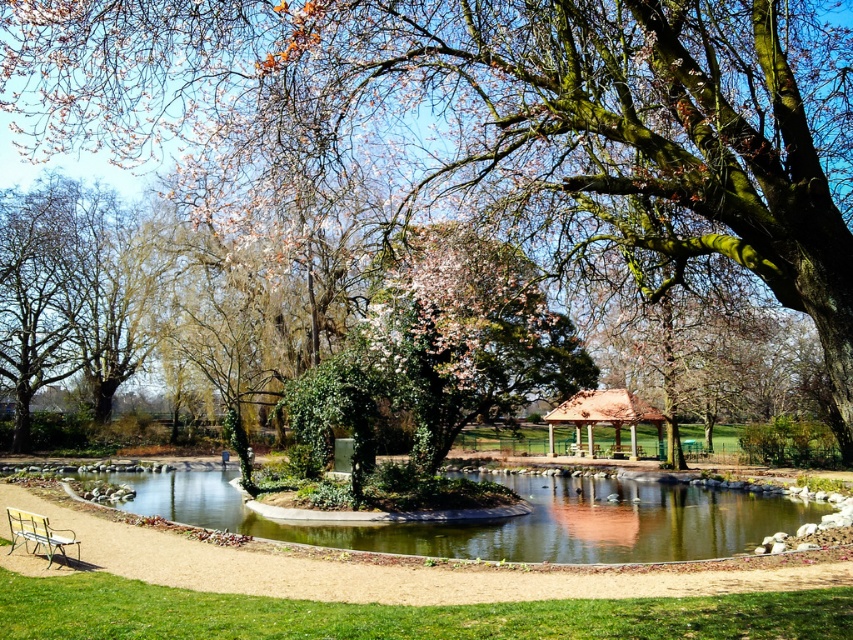
Question: Is green mossy tree at center smaller than brown wooden gazebo at center?

Choices:
 (A) no
 (B) yes

Answer: (A)

Question: Which point appears farthest from the camera in this image?

Choices:
 (A) (329, 545)
 (B) (36, 540)
 (C) (167, 131)
 (D) (641, 417)

Answer: (D)

Question: Can you confirm if green mossy tree at center is thinner than wooden park bench at lower left?

Choices:
 (A) no
 (B) yes

Answer: (A)

Question: Can you confirm if brown wooden gazebo at center is thinner than wooden park bench at lower left?

Choices:
 (A) no
 (B) yes

Answer: (A)

Question: Which is nearer to the brown wooden gazebo at center?

Choices:
 (A) green stone lake at center
 (B) green mossy tree at center

Answer: (A)

Question: Which point appears closest to the camera in this image?

Choices:
 (A) (16, 522)
 (B) (328, 534)
 (C) (631, 406)

Answer: (A)